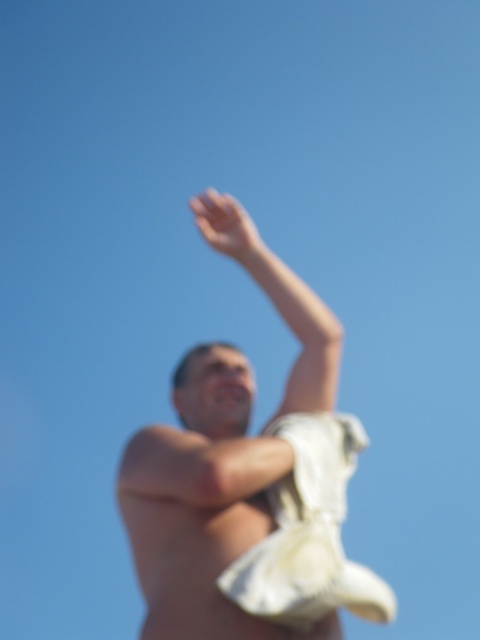
Question: Does white cloth at upper center lie in front of smooth white arm at upper center?

Choices:
 (A) yes
 (B) no

Answer: (A)

Question: Can you confirm if white cloth at upper center is thinner than smooth white arm at upper center?

Choices:
 (A) no
 (B) yes

Answer: (B)

Question: Which point is farther to the camera?

Choices:
 (A) white cloth at upper center
 (B) smooth white arm at upper center

Answer: (B)

Question: Which of the following is the farthest from the observer?

Choices:
 (A) smooth white arm at upper center
 (B) white cloth at upper center

Answer: (A)

Question: Is white cloth at upper center thinner than smooth white arm at upper center?

Choices:
 (A) yes
 (B) no

Answer: (A)